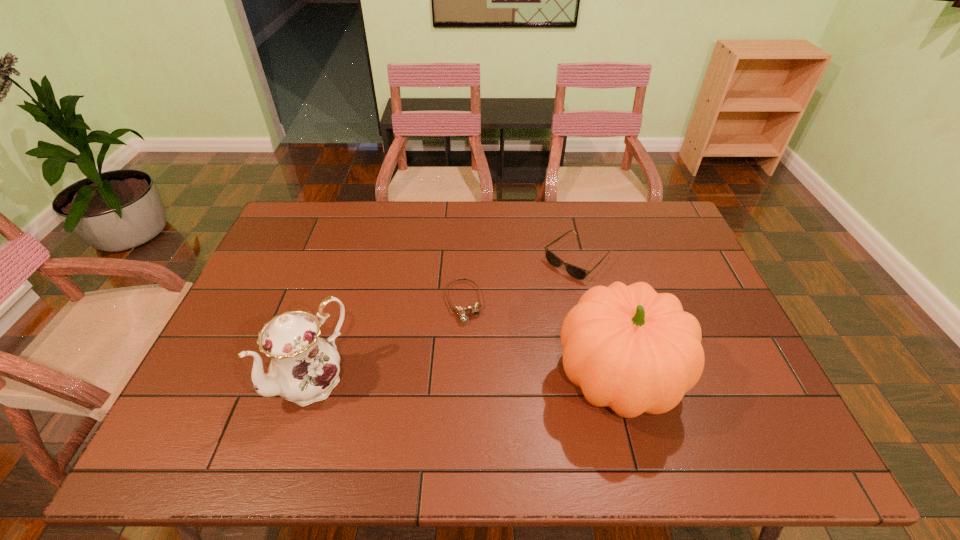
Where is `free space at the far right corner of the desktop`? The width and height of the screenshot is (960, 540). free space at the far right corner of the desktop is located at coordinates (648, 224).

Where is `vacant space at the near right corner`? Image resolution: width=960 pixels, height=540 pixels. vacant space at the near right corner is located at coordinates (762, 402).

The image size is (960, 540). What are the coordinates of `vacant area that lies between the leftmost object and the second object from left to right` in the screenshot? It's located at (389, 341).

You are a GUI agent. You are given a task and a screenshot of the screen. Output one action in this format:
    pyautogui.click(x=<x>, y=<y>)
    Task: Click on the free space that is in between the sunglasses and the leftmost object
    The height and width of the screenshot is (540, 960).
    Given the screenshot: What is the action you would take?
    pyautogui.click(x=445, y=320)

Locate an element on the screen. free area in between the sunglasses and the shortest object is located at coordinates (520, 281).

I want to click on vacant area that lies between the chinaware and the pumpkin, so click(x=466, y=380).

I want to click on free space between the shortest object and the pumpkin, so click(x=540, y=341).

Where is `free space between the shortest object and the leftmost object`? The height and width of the screenshot is (540, 960). free space between the shortest object and the leftmost object is located at coordinates (389, 341).

Locate an element on the screen. The height and width of the screenshot is (540, 960). vacant region between the pumpkin and the chinaware is located at coordinates (466, 380).

This screenshot has width=960, height=540. I want to click on free space between the chinaware and the sunglasses, so click(x=445, y=320).